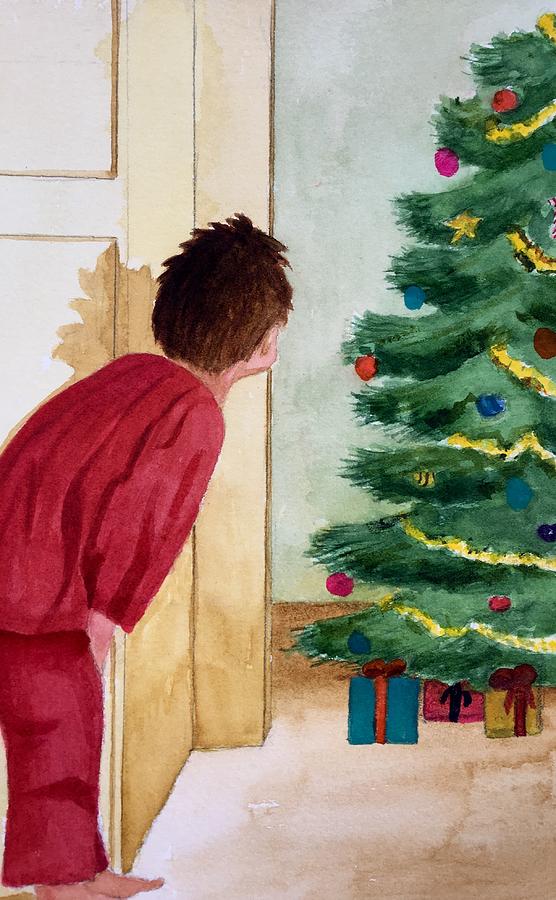
This screenshot has width=556, height=900. Find the location of `3 presents`. 3 presents is located at coordinates (501, 739).